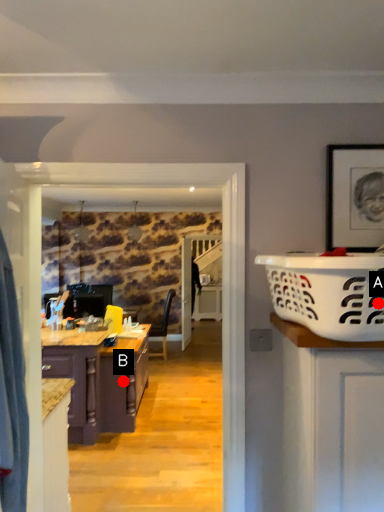
Question: Two points are circled on the image, labeled by A and B beside each circle. Among these points, which one is nearest to the camera?

Choices:
 (A) A is closer
 (B) B is closer

Answer: (A)